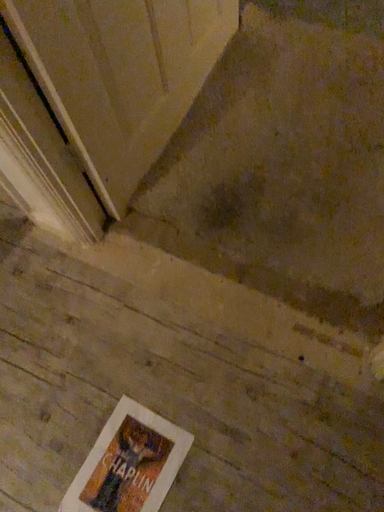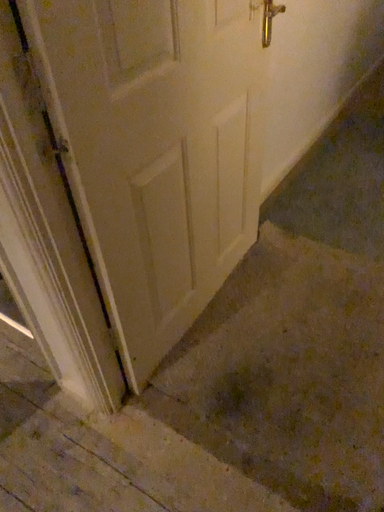
Question: Which way did the camera rotate in the video?

Choices:
 (A) rotated downward
 (B) rotated upward

Answer: (B)